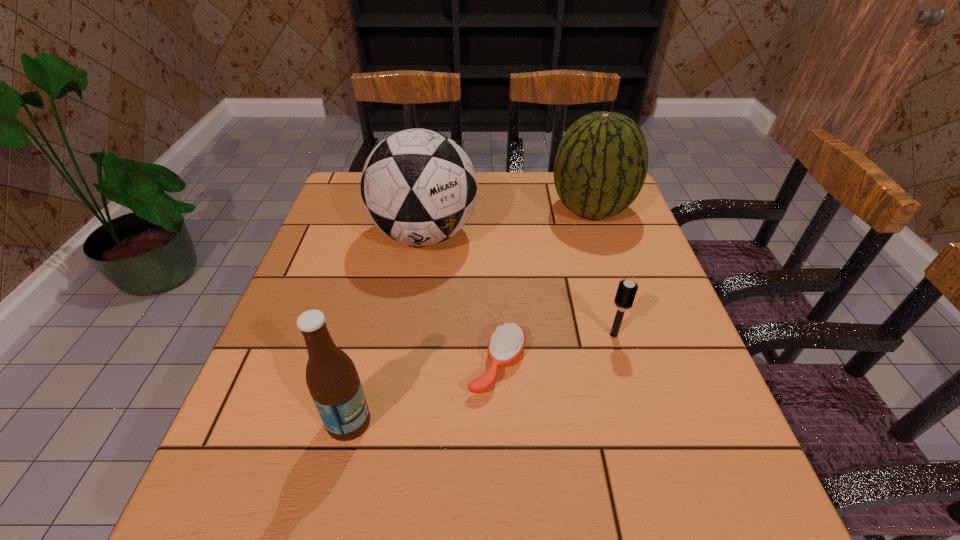
This screenshot has height=540, width=960. What are the coordinates of `vacant space located 0.220m on the left of the fourth tallest object` in the screenshot? It's located at (499, 334).

Where is `vacant space located on the right of the shorter hairbrush`? The width and height of the screenshot is (960, 540). vacant space located on the right of the shorter hairbrush is located at coordinates (638, 364).

At what (x,y) coordinates should I click in order to perform the action: click on soccer ball present at the far edge. Please return your answer as a coordinate pair (x, y). The image size is (960, 540). Looking at the image, I should click on (419, 187).

Identify the location of watermelon at the far edge. The width and height of the screenshot is (960, 540). (601, 164).

Locate an element on the screen. This screenshot has height=540, width=960. soccer ball positioned at the left edge is located at coordinates (419, 187).

Locate an element on the screen. The image size is (960, 540). beer bottle that is at the left edge is located at coordinates (332, 379).

The image size is (960, 540). What are the coordinates of `watermelon that is at the right edge` in the screenshot? It's located at (601, 164).

The height and width of the screenshot is (540, 960). What are the coordinates of `hairbrush at the right edge` in the screenshot? It's located at (626, 292).

The height and width of the screenshot is (540, 960). What are the coordinates of `object that is at the far left corner` in the screenshot? It's located at (419, 187).

Locate an element on the screen. object that is at the far right corner is located at coordinates (601, 164).